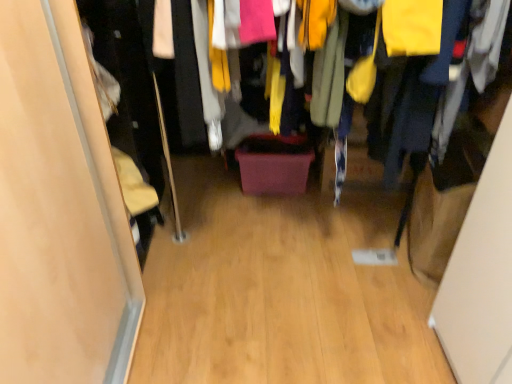
Question: In terms of size, does wooden floor at center appear bigger or smaller than wooden floor at center?

Choices:
 (A) big
 (B) small

Answer: (A)

Question: From a real-world perspective, is wooden floor at center above or below wooden floor at center?

Choices:
 (A) above
 (B) below

Answer: (A)

Question: Based on their relative distances, which object is nearer to the matte wood door at left?

Choices:
 (A) wooden floor at center
 (B) wooden floor at center

Answer: (B)

Question: Estimate the real-world distances between objects in this image. Which object is closer to the wooden floor at center?

Choices:
 (A) matte wood door at left
 (B) wooden floor at center

Answer: (A)